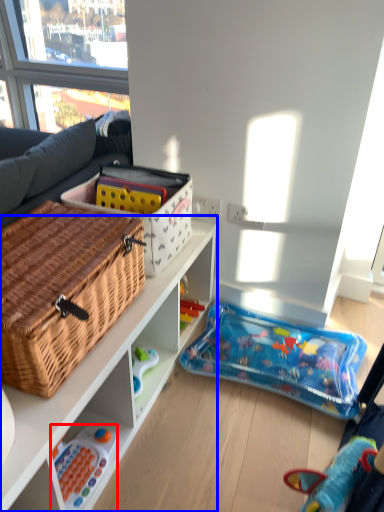
Question: Which object is further to the camera taking this photo, toy (highlighted by a red box) or cabinetry (highlighted by a blue box)?

Choices:
 (A) toy
 (B) cabinetry

Answer: (A)